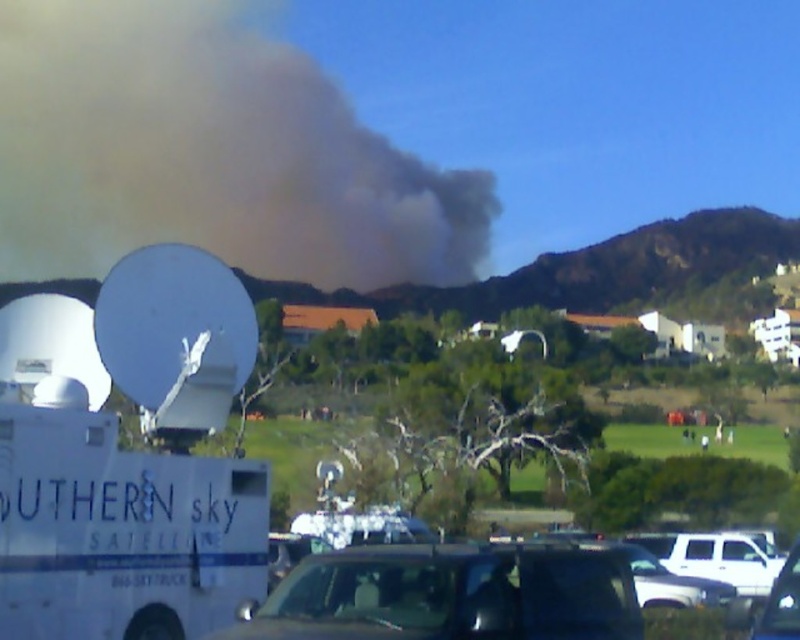
You are a firefighter trying to assess the wildfire scene. You need to reach a specific point marked at coordinates point (132, 160) to set up a firebreak. Your team has a fire truck that can travel up to 150 meters before needing to refuel. Based on the scene description, will you be able to reach the point without refueling?

The distance of point (132, 160) from camera is 187.02 meters. Since the fire truck can only travel up to 150 meters before needing to refuel, you will not be able to reach the point without refueling. You will need to refuel before proceeding.